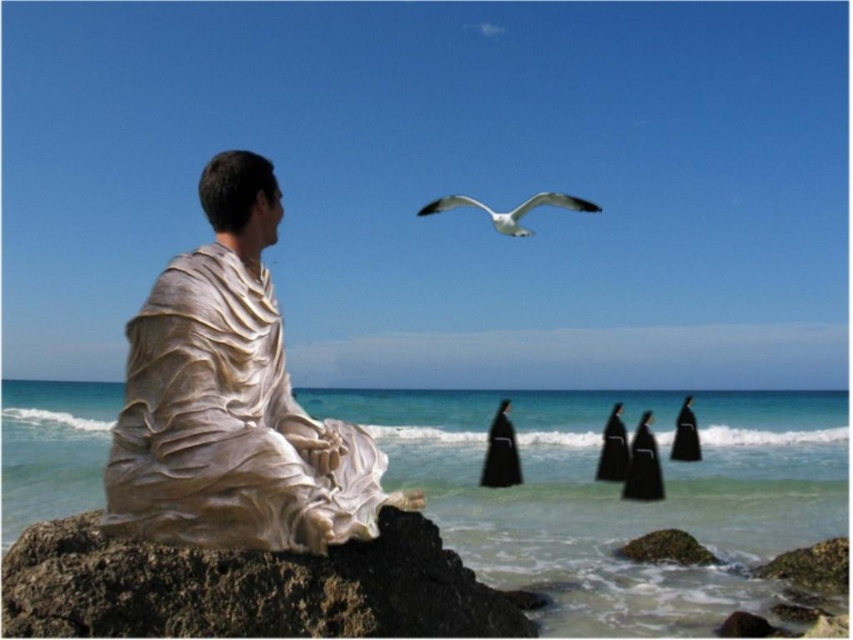
Question: Is clear blue water at lower center in front of rough textured rock at lower left?

Choices:
 (A) yes
 (B) no

Answer: (B)

Question: Which object is closer to the camera taking this photo?

Choices:
 (A) clear blue water at lower center
 (B) black matte robe at center
 (C) matte white statue at left
 (D) white glossy seagull at upper center

Answer: (C)

Question: Which of the following is the farthest from the observer?

Choices:
 (A) (187, 397)
 (B) (494, 422)

Answer: (B)

Question: Which of the following is the closest to the observer?

Choices:
 (A) black matte robe at center
 (B) clear blue water at lower center
 (C) white glossy seagull at upper center

Answer: (B)

Question: Does clear blue water at lower center have a larger size compared to rough textured rock at lower left?

Choices:
 (A) no
 (B) yes

Answer: (B)

Question: Is clear blue water at lower center positioned at the back of matte white statue at left?

Choices:
 (A) no
 (B) yes

Answer: (B)